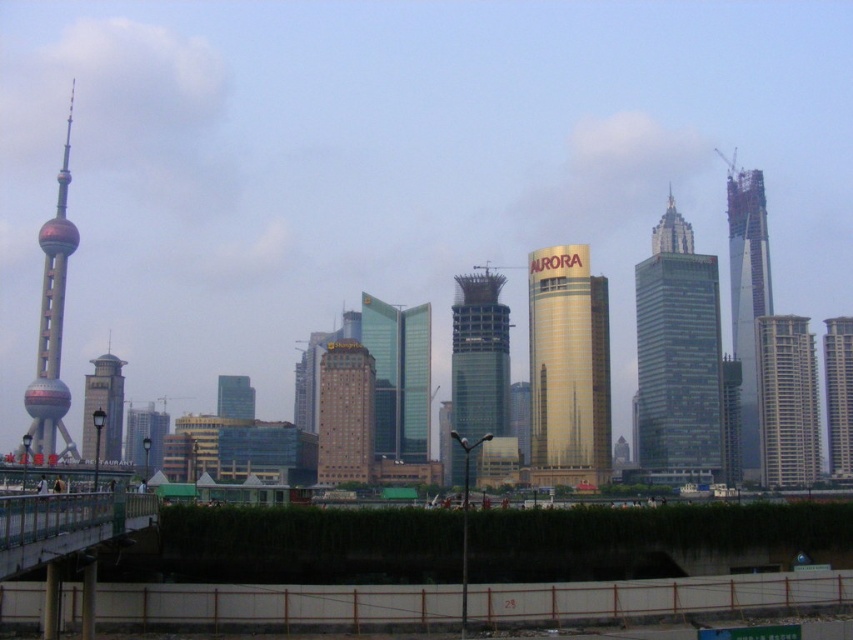
You are a tourist standing on the riverside walkway. You see the green glass skyscraper at center and the gold reflective tower at center. Which one is positioned more to the left?

The gold reflective tower at center is positioned more to the left than the green glass skyscraper at center.